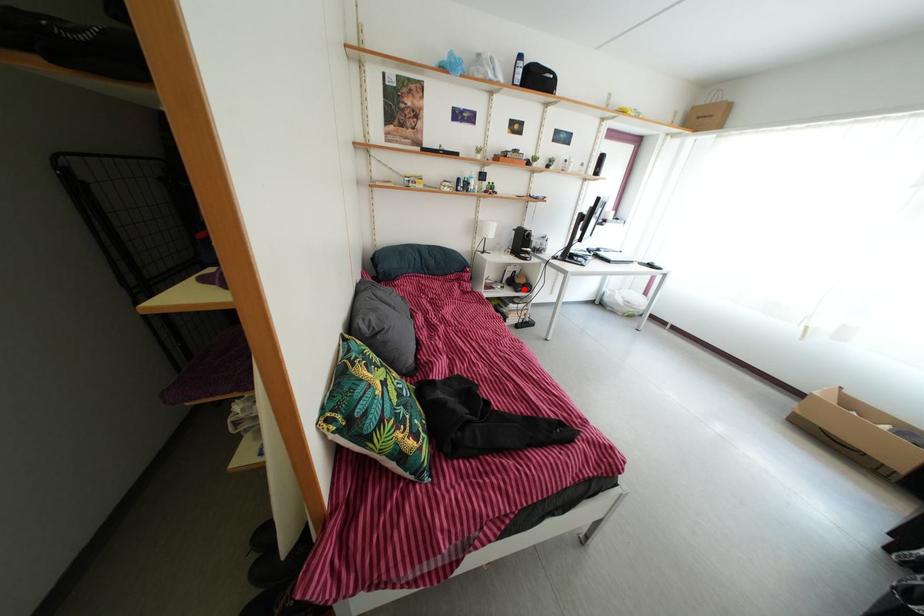
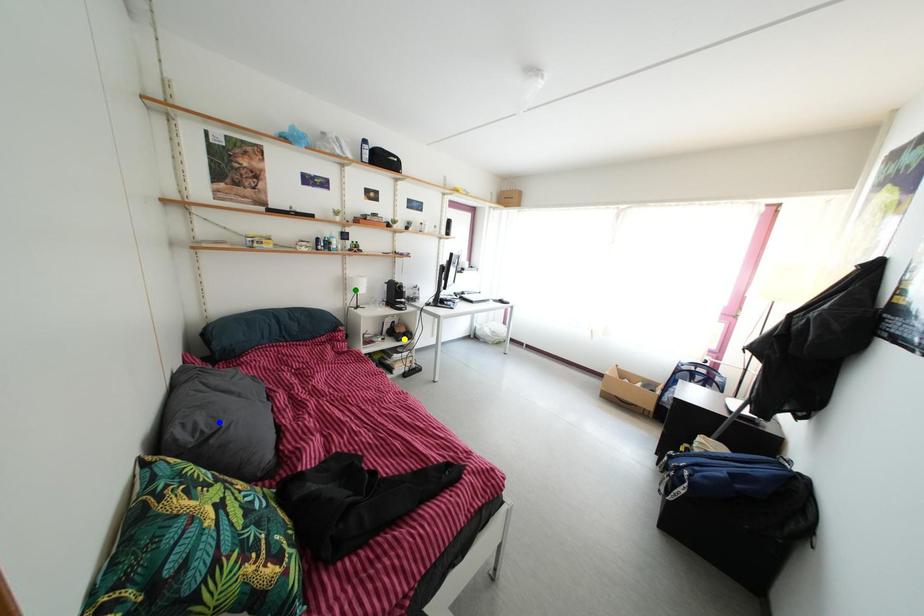
Question: I am providing you with two images of the same scene from different viewpoints. A red point is marked on the first image. You are given multiple points on the second image. Which point in image 2 is actually the same real-world point as the red point in image 1?

Choices:
 (A) yellow point
 (B) green point
 (C) blue point

Answer: (A)